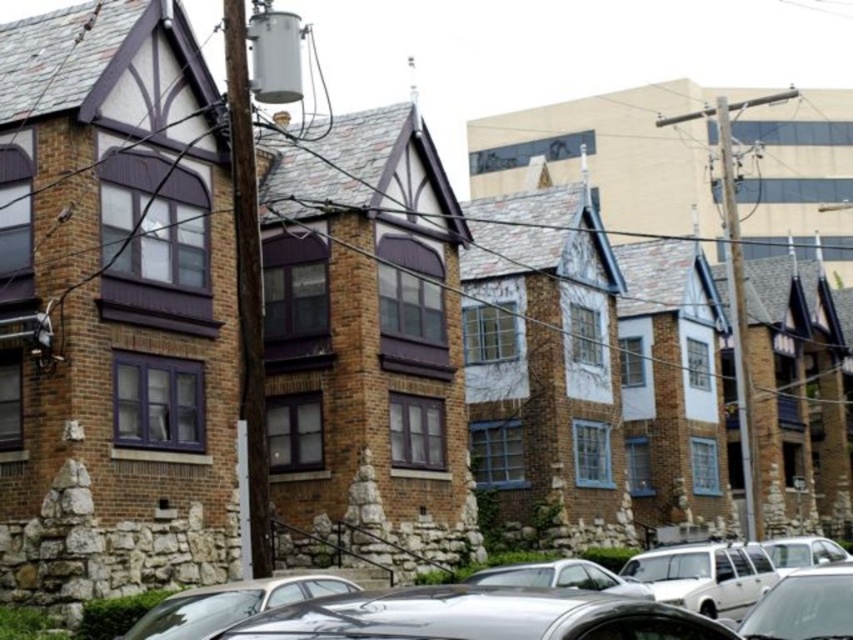
Question: Is the position of shiny silver car at lower center less distant than that of silver metallic car at lower right?

Choices:
 (A) no
 (B) yes

Answer: (B)

Question: In this image, where is shiny black car at center located relative to shiny silver car at lower right?

Choices:
 (A) left
 (B) right

Answer: (B)

Question: Estimate the real-world distances between objects in this image. Which object is farther from the shiny silver car at lower center?

Choices:
 (A) silver metallic car at lower right
 (B) metallic silver car at center
 (C) shiny silver car at lower right
 (D) white matte station wagon at lower center

Answer: (A)

Question: Is shiny black car at center above white matte station wagon at lower center?

Choices:
 (A) yes
 (B) no

Answer: (B)

Question: Which is farther from the silver metallic car at lower right?

Choices:
 (A) shiny black car at center
 (B) metallic silver car at center
 (C) shiny silver car at lower center

Answer: (C)

Question: Which point is closer to the camera taking this photo?

Choices:
 (A) (842, 564)
 (B) (738, 596)
 (C) (508, 582)
 (D) (170, 609)

Answer: (A)